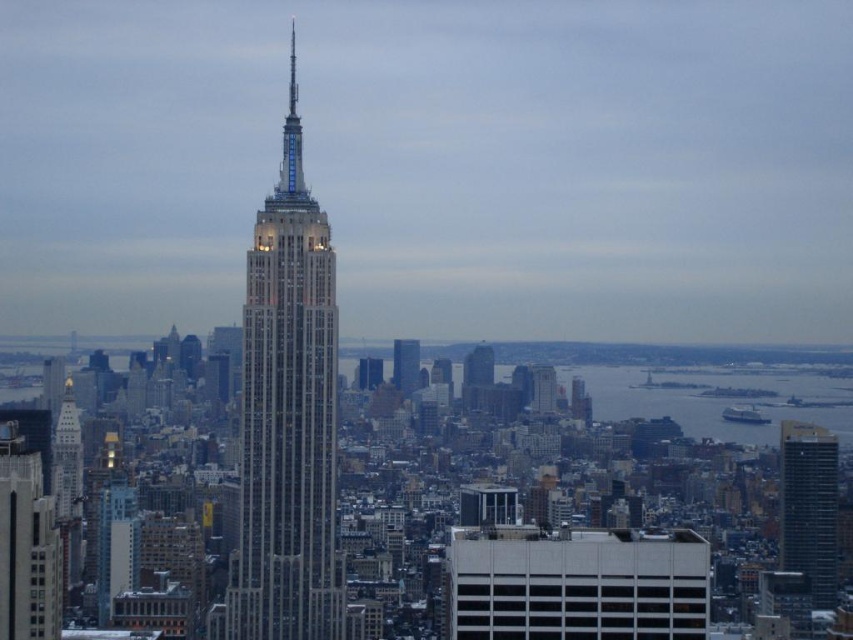
Question: Which point is farther to the camera?

Choices:
 (A) (469, 360)
 (B) (403, 376)

Answer: (A)

Question: From the image, what is the correct spatial relationship of glassy steel skyscraper at center in relation to glassy reflective skyscraper at center?

Choices:
 (A) above
 (B) below

Answer: (B)

Question: Which point is closer to the camera?

Choices:
 (A) (476, 401)
 (B) (399, 346)
 (C) (334, 339)

Answer: (C)

Question: Is the position of white marble skyscraper at center more distant than that of dark glass skyscraper at right?

Choices:
 (A) no
 (B) yes

Answer: (A)

Question: From the image, what is the correct spatial relationship of white marble skyscraper at center in relation to dark glass skyscraper at right?

Choices:
 (A) right
 (B) left

Answer: (B)

Question: Which object is positioned closest to the glassy reflective skyscraper at center?

Choices:
 (A) white marble skyscraper at center
 (B) glassy steel skyscraper at center
 (C) dark glass skyscraper at right

Answer: (B)